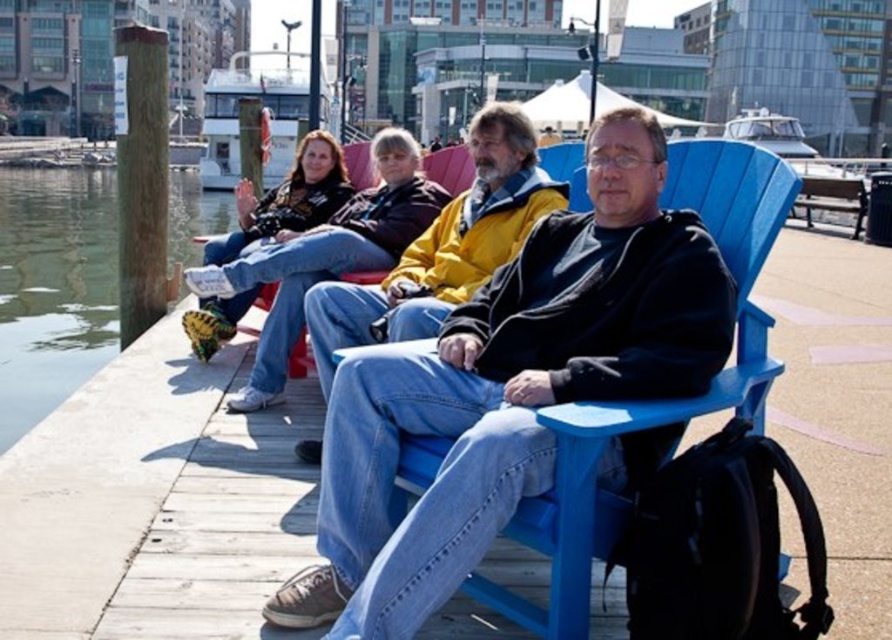
Who is lower down, matte black jacket at center or yellow matte jacket at center?

matte black jacket at center

Can you confirm if matte black jacket at center is bigger than yellow matte jacket at center?

Actually, matte black jacket at center might be smaller than yellow matte jacket at center.

Is point (720, 305) less distant than point (442, 250)?

Yes, point (720, 305) is closer to viewer.

The image size is (892, 640). In order to click on matte black jacket at center in this screenshot , I will do `click(508, 388)`.

Does clear water at dock left have a larger size compared to yellow matte jacket at center?

Correct, clear water at dock left is larger in size than yellow matte jacket at center.

Who is positioned more to the left, clear water at dock left or yellow matte jacket at center?

Positioned to the left is clear water at dock left.

The width and height of the screenshot is (892, 640). I want to click on clear water at dock left, so click(x=54, y=288).

Is matte black jacket at center closer to the viewer compared to clear water at dock left?

Yes, matte black jacket at center is closer to the viewer.

Does matte black jacket at center appear on the left side of clear water at dock left?

In fact, matte black jacket at center is to the right of clear water at dock left.

Is point (423, 364) positioned before point (197, 234)?

Yes, it is in front of point (197, 234).

This screenshot has height=640, width=892. I want to click on matte black jacket at center, so click(x=508, y=388).